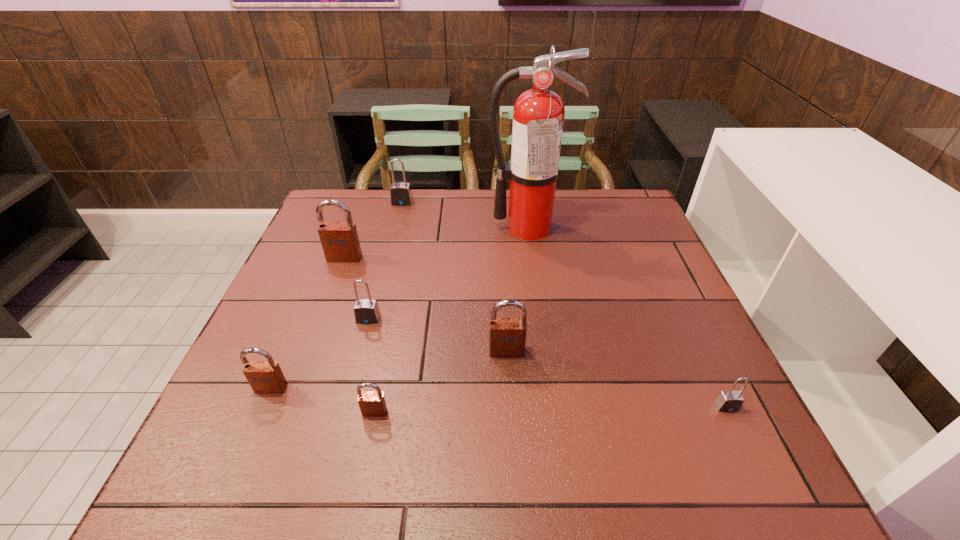
Find the location of a particular element. The height and width of the screenshot is (540, 960). fire extinguisher is located at coordinates (538, 116).

Find the location of `red fire extinguisher`. red fire extinguisher is located at coordinates (538, 116).

Identify the location of the seventh shortest object. (340, 242).

Where is `the biggest brown padlock`? The height and width of the screenshot is (540, 960). the biggest brown padlock is located at coordinates (340, 242).

Where is `the farthest padlock`? the farthest padlock is located at coordinates (400, 193).

What are the coordinates of `the farthest gray padlock` in the screenshot? It's located at (400, 193).

At what (x,y) coordinates should I click in order to perform the action: click on the rightmost brown padlock. Please return your answer as a coordinate pair (x, y). The height and width of the screenshot is (540, 960). Looking at the image, I should click on (507, 336).

You are a GUI agent. You are given a task and a screenshot of the screen. Output one action in this format:
    pyautogui.click(x=<x>, y=<y>)
    Task: Click on the third smallest brown padlock
    The image size is (960, 540).
    Given the screenshot: What is the action you would take?
    pyautogui.click(x=507, y=336)

Find the location of a particular element. Image resolution: width=960 pixels, height=540 pixels. the third farthest padlock is located at coordinates (366, 311).

The width and height of the screenshot is (960, 540). What are the coordinates of `the fifth nearest object` in the screenshot? It's located at click(x=366, y=311).